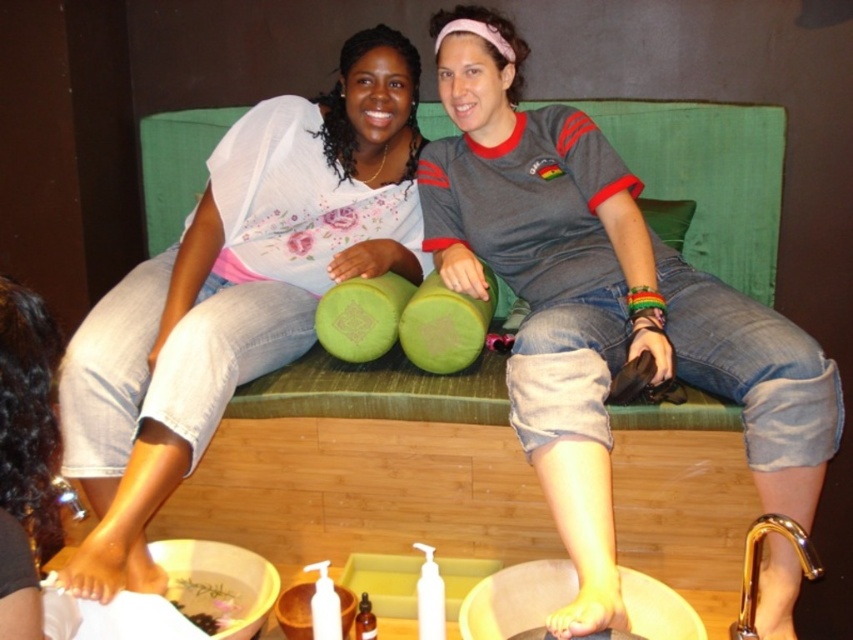
The width and height of the screenshot is (853, 640). I want to click on matte gray shirt at center, so click(601, 307).

Where is `matte gray shirt at center`? Image resolution: width=853 pixels, height=640 pixels. matte gray shirt at center is located at coordinates (601, 307).

Between point (537, 307) and point (648, 202), which one is positioned in front?

Point (537, 307)

Between matte gray shirt at center and green fabric pillow at center, which one appears on the left side from the viewer's perspective?

Positioned to the left is matte gray shirt at center.

What are the coordinates of `matte gray shirt at center` in the screenshot? It's located at (601, 307).

Where is `matte gray shirt at center`? matte gray shirt at center is located at coordinates (601, 307).

Is matte white blouse at upper left thinner than green fabric pillow at center?

Incorrect, matte white blouse at upper left's width is not less than green fabric pillow at center's.

Who is higher up, matte white blouse at upper left or green fabric pillow at center?

green fabric pillow at center is above.

Is point (254, 305) positioned after point (660, 221)?

No, (254, 305) is in front of (660, 221).

Where is `matte white blouse at upper left`? Image resolution: width=853 pixels, height=640 pixels. matte white blouse at upper left is located at coordinates (236, 292).